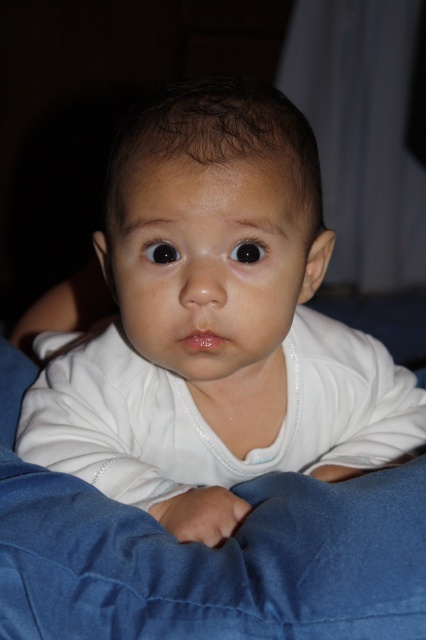
From the picture: Who is lower down, white smooth baby at center or denim at center?

denim at center is below.

Is white smooth baby at center further to camera compared to denim at center?

Yes, white smooth baby at center is behind denim at center.

Locate an element on the screen. The height and width of the screenshot is (640, 426). white smooth baby at center is located at coordinates (216, 324).